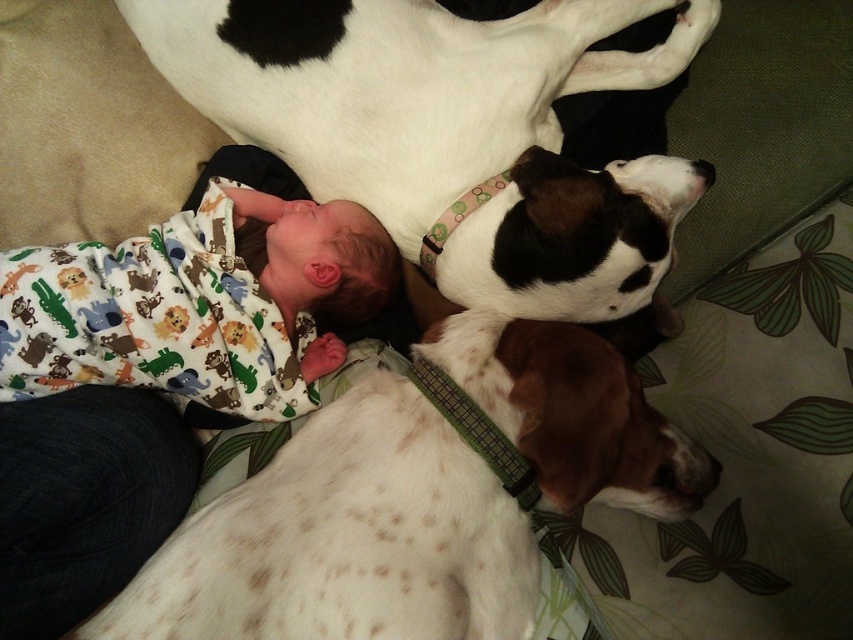
In the scene shown: Can you confirm if speckled white dog at lower left is thinner than printed flannel baby at center?

In fact, speckled white dog at lower left might be wider than printed flannel baby at center.

Image resolution: width=853 pixels, height=640 pixels. What do you see at coordinates (345, 540) in the screenshot?
I see `speckled white dog at lower left` at bounding box center [345, 540].

Measure the distance between speckled white dog at lower left and camera.

speckled white dog at lower left and camera are 29.27 inches apart from each other.

This screenshot has width=853, height=640. Identify the location of speckled white dog at lower left. (345, 540).

Is white speckled fur at upper center above speckled white dog at lower left?

Yes, white speckled fur at upper center is above speckled white dog at lower left.

Locate an element on the screen. The image size is (853, 640). white speckled fur at upper center is located at coordinates (450, 131).

Who is more distant from viewer, (550, 3) or (250, 560)?

The point (550, 3) is behind.

Locate an element on the screen. white speckled fur at upper center is located at coordinates (450, 131).

Looking at this image, can you confirm if white speckled fur at upper center is positioned to the left of printed flannel baby at center?

In fact, white speckled fur at upper center is to the right of printed flannel baby at center.

Which is in front, point (616, 10) or point (107, 250)?

Point (616, 10)

Image resolution: width=853 pixels, height=640 pixels. Identify the location of white speckled fur at upper center. pos(450,131).